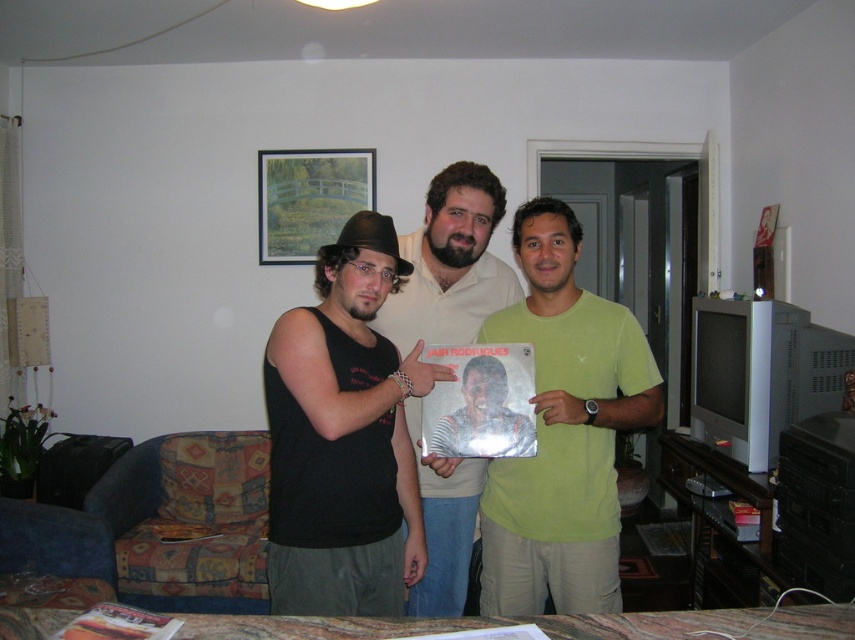
Question: Is black matte tank top at center to the left of brown felt cowboy hat at center from the viewer's perspective?

Choices:
 (A) no
 (B) yes

Answer: (B)

Question: Can you confirm if matte white shirt at center is positioned above brown felt cowboy hat at center?

Choices:
 (A) no
 (B) yes

Answer: (A)

Question: Estimate the real-world distances between objects in this image. Which object is farther from the matte wooden picture frame at upper center?

Choices:
 (A) green matte shirt at center
 (B) black matte tank top at center
 (C) matte white shirt at center
 (D) brown felt cowboy hat at center

Answer: (B)

Question: Which point is farther to the camera?

Choices:
 (A) brown felt cowboy hat at center
 (B) matte white shirt at center
 (C) black matte tank top at center
 (D) matte wooden picture frame at upper center

Answer: (D)

Question: Does matte plastic photo at center lie behind brown felt cowboy hat at center?

Choices:
 (A) yes
 (B) no

Answer: (A)

Question: Which point is farther from the camera taking this photo?

Choices:
 (A) (445, 256)
 (B) (502, 410)
 (C) (298, 602)
 (D) (549, 593)

Answer: (D)